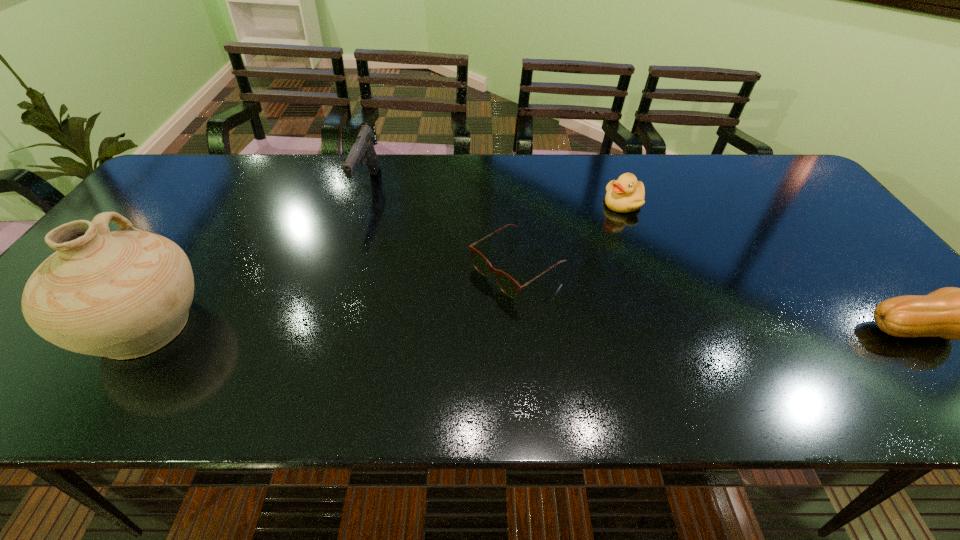
Identify the location of the tallest object. The width and height of the screenshot is (960, 540). (124, 294).

I want to click on pottery, so click(124, 294).

What are the coordinates of `duckling` in the screenshot? It's located at (626, 194).

Find the location of a particular element. the third object from right to left is located at coordinates (509, 286).

Where is `the shortest object`? the shortest object is located at coordinates (509, 286).

Where is `the second tallest object`? the second tallest object is located at coordinates (363, 148).

Where is `the second object from left to right`? This screenshot has height=540, width=960. the second object from left to right is located at coordinates (363, 148).

Locate an element on the screen. This screenshot has width=960, height=540. vacant area situated on the back of the leftmost object is located at coordinates (219, 215).

The height and width of the screenshot is (540, 960). In order to click on free spot located on the front-facing side of the fourth object from left to right in this screenshot , I will do `click(585, 271)`.

Identify the location of free space located 0.310m on the front-facing side of the fourth object from left to right. This screenshot has width=960, height=540. (578, 284).